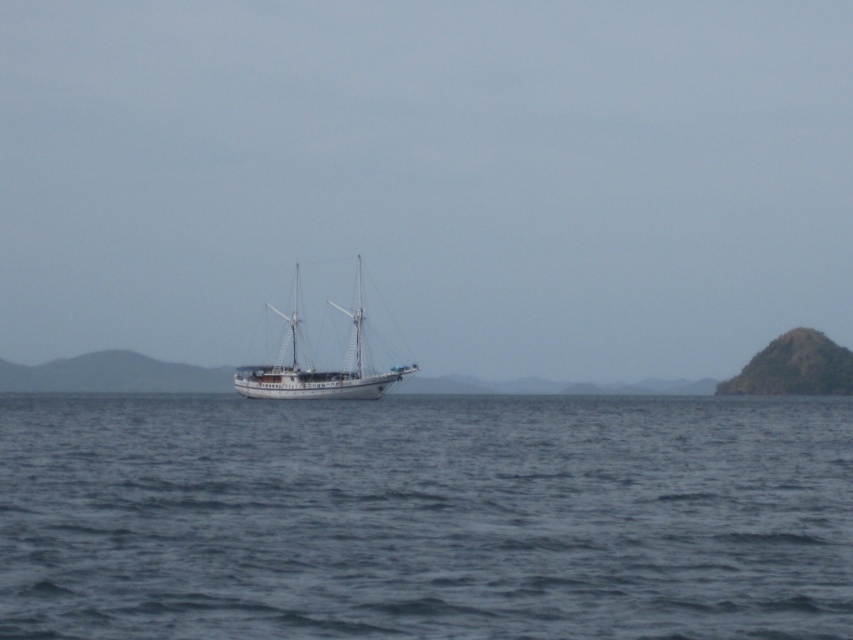
Question: Considering the real-world distances, which object is farthest from the blue water at center?

Choices:
 (A) green rocky island at right
 (B) white matte sailboat at center

Answer: (A)

Question: Is white matte sailboat at center to the right of green rocky island at right from the viewer's perspective?

Choices:
 (A) yes
 (B) no

Answer: (B)

Question: Is blue water at center above white matte sailboat at center?

Choices:
 (A) no
 (B) yes

Answer: (A)

Question: Which object is closer to the camera taking this photo?

Choices:
 (A) green rocky island at right
 (B) white matte sailboat at center
 (C) blue water at center

Answer: (C)

Question: Can you confirm if blue water at center is positioned below green rocky island at right?

Choices:
 (A) no
 (B) yes

Answer: (A)

Question: Which of the following is the closest to the observer?

Choices:
 (A) green rocky island at right
 (B) white matte sailboat at center
 (C) blue water at center

Answer: (C)